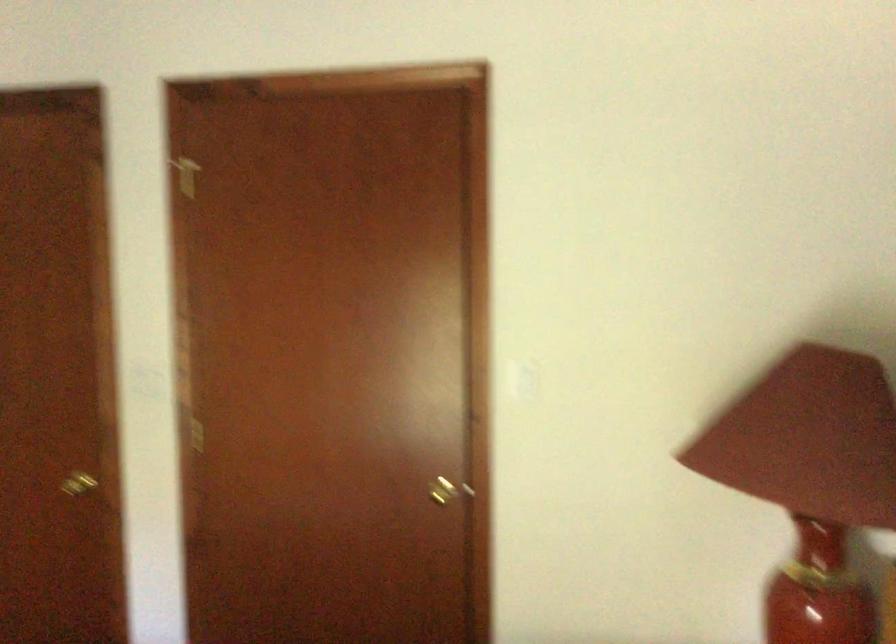
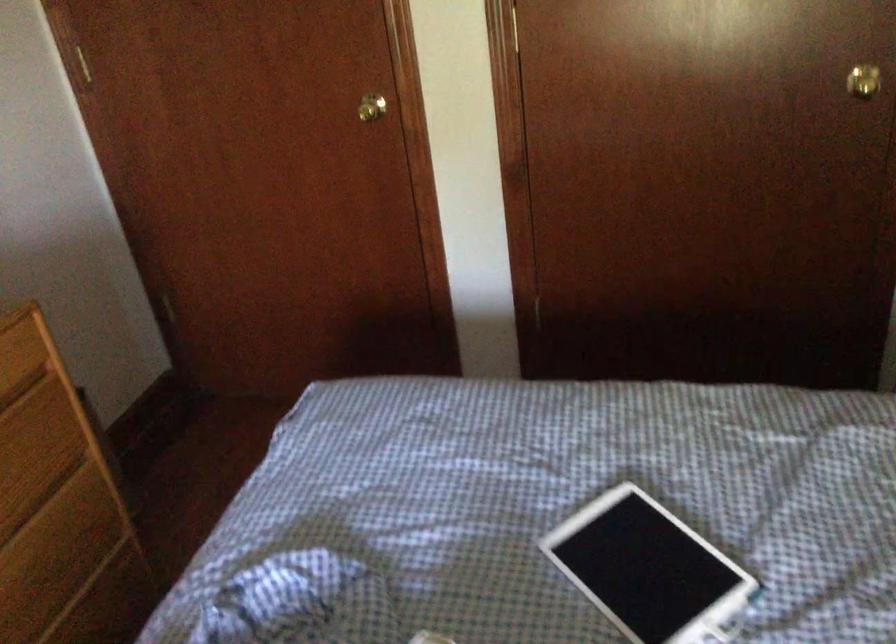
Question: The images are taken continuously from a first-person perspective. In which direction is your viewpoint rotating?

Choices:
 (A) Left
 (B) Right
 (C) Up
 (D) Down

Answer: (D)